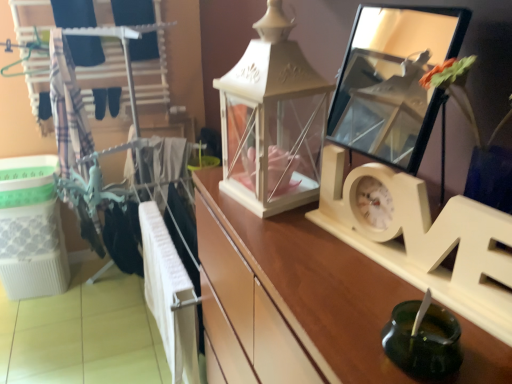
The image size is (512, 384). I want to click on plaid fabric at left, so click(68, 109).

The height and width of the screenshot is (384, 512). What do you see at coordinates (393, 80) in the screenshot? I see `clear glass mirror at upper right` at bounding box center [393, 80].

Image resolution: width=512 pixels, height=384 pixels. In order to click on white wood clock at center in this screenshot , I will do `click(300, 287)`.

Locate an element on the screen. The height and width of the screenshot is (384, 512). wooden drawer at center is located at coordinates (250, 310).

Is plaid fabric at left to the left or to the right of wooden drawer at center in the image?

Clearly, plaid fabric at left is on the left of wooden drawer at center in the image.

Is plaid fabric at left spatially inside wooden drawer at center, or outside of it?

plaid fabric at left is not inside wooden drawer at center, it's outside.

From a real-world perspective, which is physically above, plaid fabric at left or wooden drawer at center?

plaid fabric at left, from a real-world perspective.

How different are the orientations of plaid fabric at left and wooden drawer at center in degrees?

88.5 degrees separate the facing orientations of plaid fabric at left and wooden drawer at center.

The image size is (512, 384). I want to click on writing on the left of the clear glass mirror at upper right, so click(x=272, y=121).

From a real-world perspective, which is physically above, white matte lantern at center or clear glass mirror at upper right?

clear glass mirror at upper right is physically above.

Would you say white matte lantern at center is inside or outside clear glass mirror at upper right?

white matte lantern at center is not enclosed by clear glass mirror at upper right.

From the picture: Is green glass candle holder at lower right completely or partially outside of white matte lantern at center?

Yes.

Does green glass candle holder at lower right appear on the left side of white matte lantern at center?

In fact, green glass candle holder at lower right is to the right of white matte lantern at center.

Is green glass candle holder at lower right taller than white matte lantern at center?

In fact, green glass candle holder at lower right may be shorter than white matte lantern at center.

Is green glass candle holder at lower right far away from white matte lantern at center?

No, green glass candle holder at lower right is in close proximity to white matte lantern at center.

Is white wood clock at center in front of or behind wooden drawer at center in the image?

white wood clock at center is positioned closer to the viewer than wooden drawer at center.

Considering the sizes of objects white wood clock at center and wooden drawer at center in the image provided, who is wider, white wood clock at center or wooden drawer at center?

With larger width is wooden drawer at center.

Which of these two, white wood clock at center or wooden drawer at center, is smaller?

Smaller between the two is white wood clock at center.

Are white wood clock at center and wooden drawer at center beside each other?

Indeed, white wood clock at center and wooden drawer at center are beside each other and touching.

Would you say clear glass mirror at upper right is to the left or to the right of plaid fabric at left in the picture?

From the image, it's evident that clear glass mirror at upper right is to the right of plaid fabric at left.

Consider the image. Is the position of clear glass mirror at upper right less distant than that of plaid fabric at left?

Yes, it is.

Is clear glass mirror at upper right situated inside plaid fabric at left or outside?

clear glass mirror at upper right is not inside plaid fabric at left, it's outside.

Looking at their sizes, would you say clear glass mirror at upper right is wider or thinner than plaid fabric at left?

clear glass mirror at upper right is thinner than plaid fabric at left.

Is green glass candle holder at lower right situated inside plaid fabric at left or outside?

The correct answer is: outside.

Is green glass candle holder at lower right directly adjacent to plaid fabric at left?

green glass candle holder at lower right is not next to plaid fabric at left, and they're not touching.

From a real-world perspective, is green glass candle holder at lower right under plaid fabric at left?

No, from a real-world perspective, green glass candle holder at lower right is not beneath plaid fabric at left.

Between green glass candle holder at lower right and plaid fabric at left, which one appears on the left side from the viewer's perspective?

From the viewer's perspective, plaid fabric at left appears more on the left side.

Between white matte lantern at center and green glass candle holder at lower right, which one appears on the left side from the viewer's perspective?

From the viewer's perspective, white matte lantern at center appears more on the left side.

How different are the orientations of white matte lantern at center and green glass candle holder at lower right in degrees?

They differ by 9.88 degrees in their facing directions.

The width and height of the screenshot is (512, 384). What are the coordinates of `candle holder below the white matte lantern at center (from a real-world perspective)` in the screenshot? It's located at (423, 341).

Considering the sizes of white matte lantern at center and green glass candle holder at lower right in the image, is white matte lantern at center bigger or smaller than green glass candle holder at lower right?

Considering their sizes, white matte lantern at center takes up more space than green glass candle holder at lower right.

The image size is (512, 384). Identify the location of drawer in front of the plaid fabric at left. (250, 310).

Locate an element on the screen. Image resolution: width=512 pixels, height=384 pixels. writing on the left of clear glass mirror at upper right is located at coordinates (272, 121).

Considering their positions, is green glass candle holder at lower right positioned closer to plaid fabric at left than clear glass mirror at upper right?

green glass candle holder at lower right is positioned closer to the anchor plaid fabric at left.

Which object lies further to the anchor point white wood clock at center, clear glass mirror at upper right or wooden drawer at center?

clear glass mirror at upper right is positioned further to the anchor white wood clock at center.

Estimate the real-world distances between objects in this image. Which object is closer to white wood clock at center, clear glass mirror at upper right or white matte lantern at center?

Among the two, white matte lantern at center is located nearer to white wood clock at center.

Looking at the image, which one is located further to green glass candle holder at lower right, plaid fabric at left or white matte lantern at center?

plaid fabric at left is further to green glass candle holder at lower right.

In the scene shown: When comparing their distances from wooden drawer at center, does clear glass mirror at upper right or white matte lantern at center seem further?

Based on the image, clear glass mirror at upper right appears to be further to wooden drawer at center.

Based on their spatial positions, is plaid fabric at left or wooden drawer at center closer to green glass candle holder at lower right?

Among the two, wooden drawer at center is located nearer to green glass candle holder at lower right.

Looking at the image, which one is located closer to clear glass mirror at upper right, green glass candle holder at lower right or plaid fabric at left?

Based on the image, plaid fabric at left appears to be nearer to clear glass mirror at upper right.

When comparing their distances from white wood clock at center, does white matte lantern at center or wooden drawer at center seem closer?

Based on the image, wooden drawer at center appears to be nearer to white wood clock at center.

Locate an element on the screen. The height and width of the screenshot is (384, 512). writing between clear glass mirror at upper right and wooden drawer at center vertically is located at coordinates (272, 121).

Image resolution: width=512 pixels, height=384 pixels. Find the location of `writing between clear glass mirror at upper right and white wood clock at center in the up-down direction`. writing between clear glass mirror at upper right and white wood clock at center in the up-down direction is located at coordinates (272, 121).

Locate an element on the screen. This screenshot has height=384, width=512. cabinetry between clear glass mirror at upper right and green glass candle holder at lower right from top to bottom is located at coordinates (300, 287).

Image resolution: width=512 pixels, height=384 pixels. Identify the location of drawer between white matte lantern at center and plaid fabric at left from front to back. (250, 310).